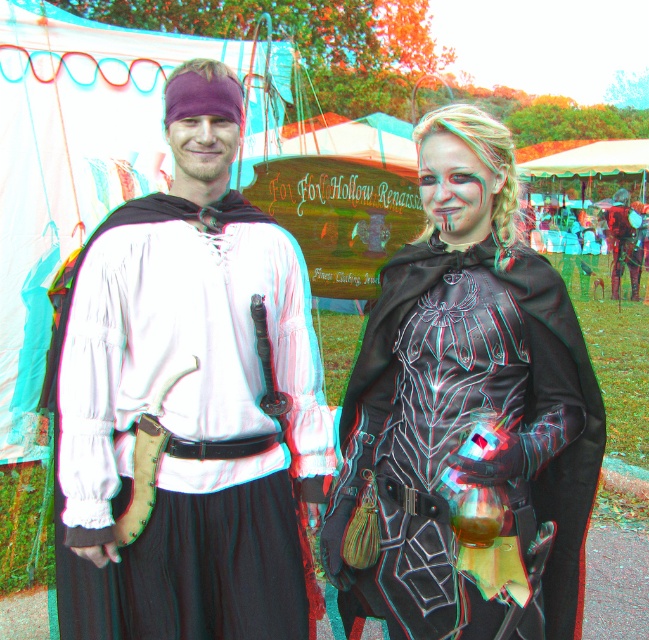
Does matte white shirt at center appear on the right side of black leather cape at center?

Incorrect, matte white shirt at center is not on the right side of black leather cape at center.

Is matte white shirt at center thinner than black leather cape at center?

Correct, matte white shirt at center's width is less than black leather cape at center's.

Is point (156, 264) positioned in front of point (461, 157)?

That is False.

The image size is (649, 640). Find the location of `matte white shirt at center`. matte white shirt at center is located at coordinates (191, 394).